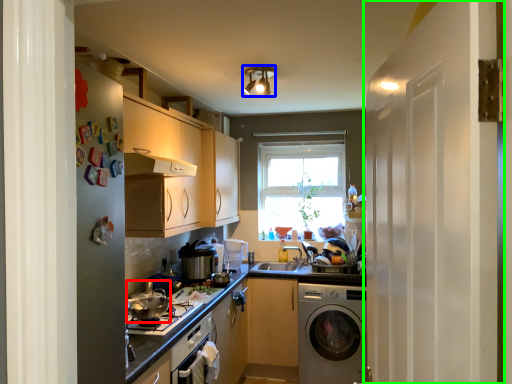
Question: Based on their relative distances, which object is farther from appliance (highlighted by a red box)? Choose from light fixture (highlighted by a blue box) and screen door (highlighted by a green box).

Choices:
 (A) light fixture
 (B) screen door

Answer: (A)